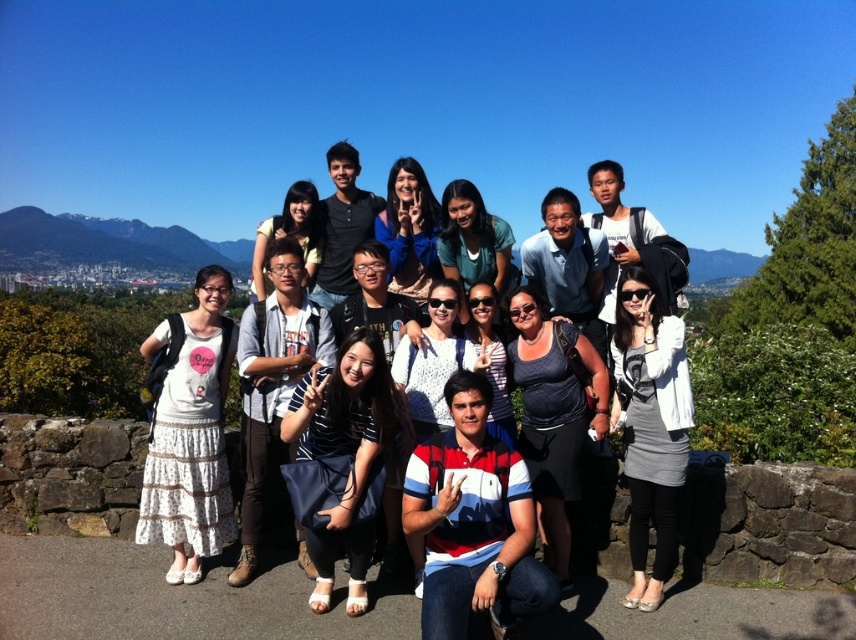
Question: Estimate the real-world distances between objects in this image. Which object is farther from the matte gray backpack at center?

Choices:
 (A) striped cotton polo shirt at center
 (B) dark gray fabric dress at center

Answer: (B)

Question: Is gray fabric dress at center to the right of dark gray fabric dress at center from the viewer's perspective?

Choices:
 (A) yes
 (B) no

Answer: (A)

Question: Is white cotton dress at left positioned at the back of matte gray backpack at center?

Choices:
 (A) yes
 (B) no

Answer: (A)

Question: Can you confirm if striped cotton polo shirt at center is smaller than gray fabric dress at center?

Choices:
 (A) no
 (B) yes

Answer: (A)

Question: Which object is farther from the camera taking this photo?

Choices:
 (A) striped cotton polo shirt at center
 (B) dark gray fabric dress at center

Answer: (B)

Question: Among these objects, which one is farthest from the camera?

Choices:
 (A) white cotton dress at left
 (B) dark gray fabric dress at center
 (C) matte gray backpack at center
 (D) gray fabric dress at center

Answer: (B)